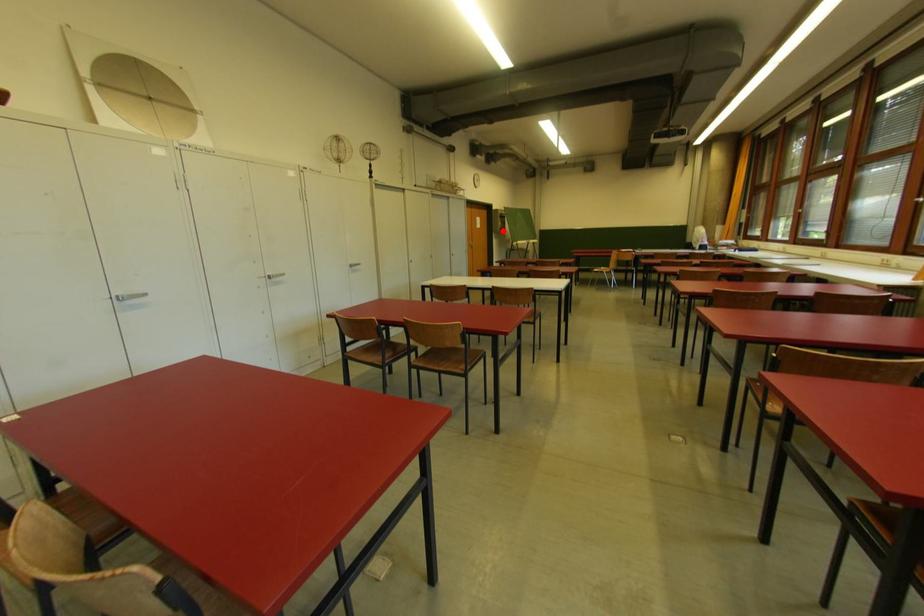
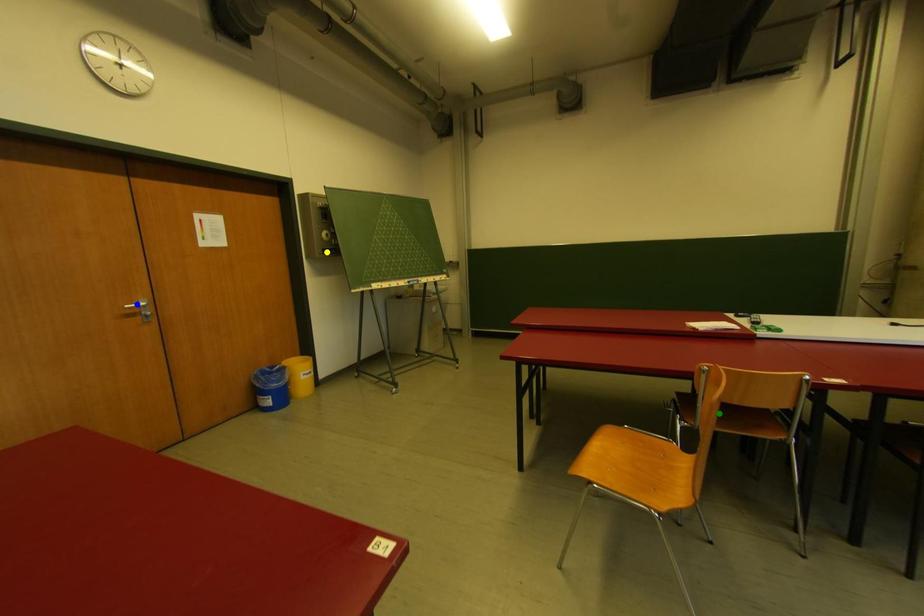
Question: I am providing you with two images of the same scene from different viewpoints. A red point is marked on the first image. You are given multiple points on the second image. Which point in image 2 is actually the same real-world point as the red point in image 1?

Choices:
 (A) green point
 (B) blue point
 (C) yellow point

Answer: (C)